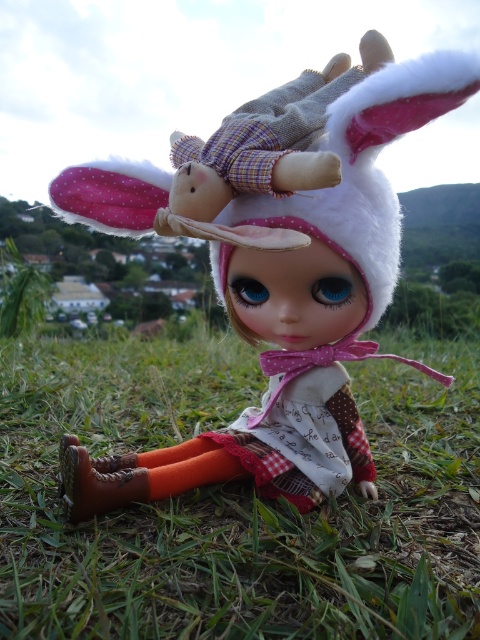
Which is behind, point (392, 561) or point (119, 464)?

Point (119, 464)

Between green grass at center and matte fabric doll at center, which one appears on the left side from the viewer's perspective?

From the viewer's perspective, green grass at center appears more on the left side.

Who is more forward, [347,548] or [266,394]?

Positioned in front is point [347,548].

Image resolution: width=480 pixels, height=640 pixels. Find the location of `green grass at center`. green grass at center is located at coordinates (236, 500).